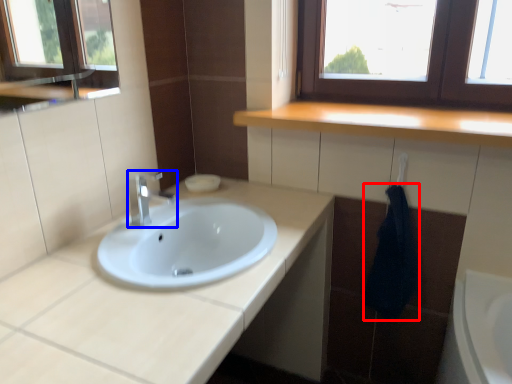
Question: Which point is further to the camera, bath towel (highlighted by a red box) or tap (highlighted by a blue box)?

Choices:
 (A) bath towel
 (B) tap

Answer: (A)